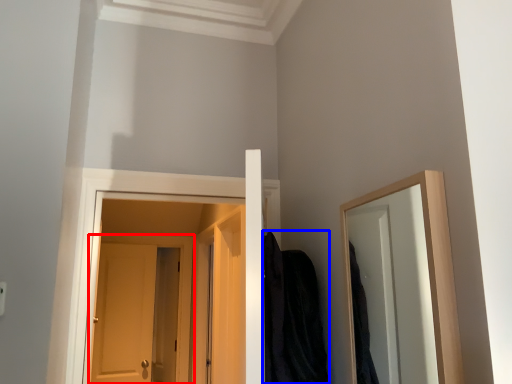
Question: Which point is further to the camera, door (highlighted by a red box) or robe (highlighted by a blue box)?

Choices:
 (A) door
 (B) robe

Answer: (A)